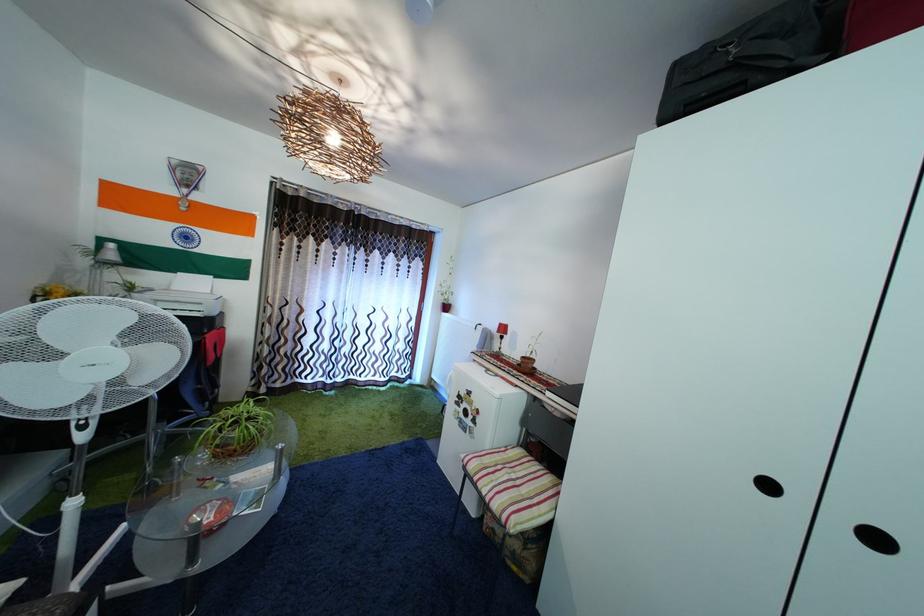
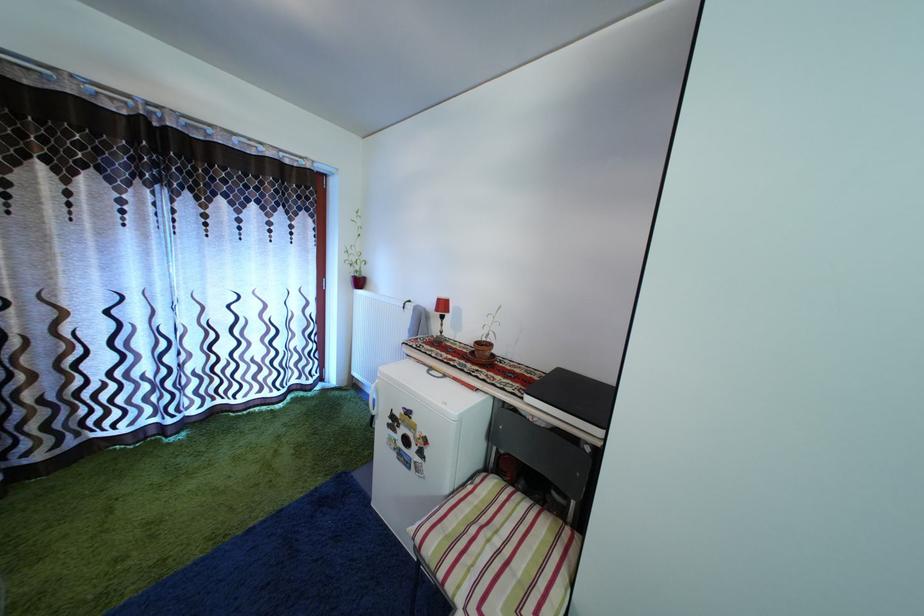
Where in the second image is the point corresponding to point 521,484 from the first image?

(505, 549)